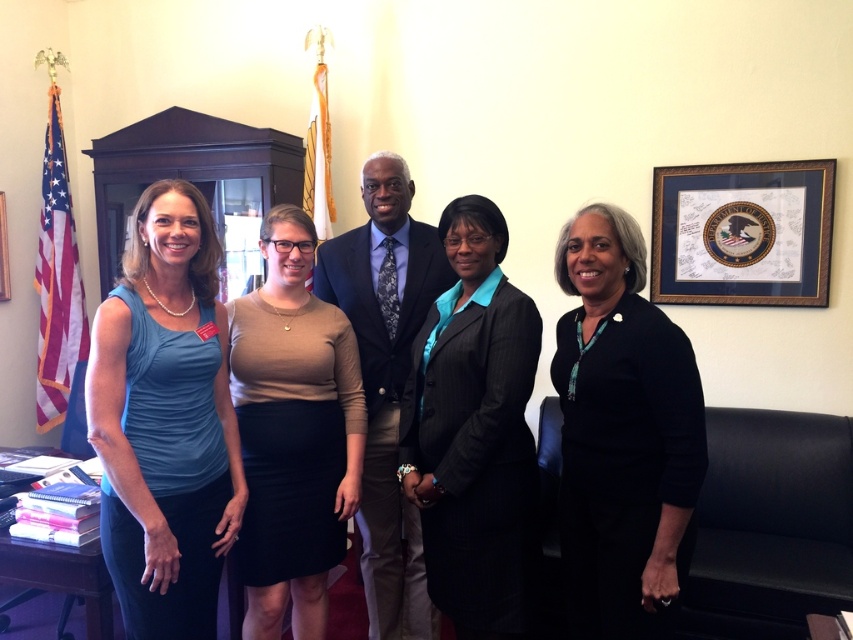
Question: Estimate the real-world distances between objects in this image. Which object is farther from the dark blue suit at center?

Choices:
 (A) black velvet blazer at center
 (B) wooden picture frame at upper center
 (C) gold-framed picture at upper right

Answer: (B)

Question: Which object is positioned closest to the dark blue suit at center?

Choices:
 (A) black pinstripe suit at center
 (B) wooden picture frame at upper center
 (C) black velvet blazer at center
 (D) blue fabric dress at left

Answer: (A)

Question: Can you confirm if dark blue suit at center is thinner than wooden picture frame at upper center?

Choices:
 (A) yes
 (B) no

Answer: (B)

Question: In this image, where is black velvet blazer at center located relative to black pinstripe suit at center?

Choices:
 (A) above
 (B) below

Answer: (B)

Question: Is blue fabric dress at left bigger than wooden picture frame at upper center?

Choices:
 (A) no
 (B) yes

Answer: (B)

Question: Which object is positioned closest to the blue fabric dress at left?

Choices:
 (A) black pinstripe suit at center
 (B) gold-framed picture at upper right
 (C) brown matte dress at center
 (D) wooden picture frame at upper center

Answer: (C)